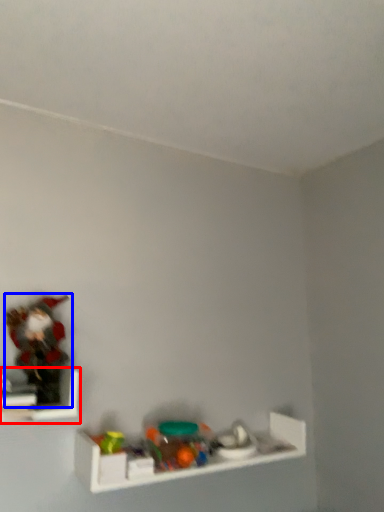
Question: Which object appears closest to the camera in this image, shelf (highlighted by a red box) or toy (highlighted by a blue box)?

Choices:
 (A) shelf
 (B) toy

Answer: (A)